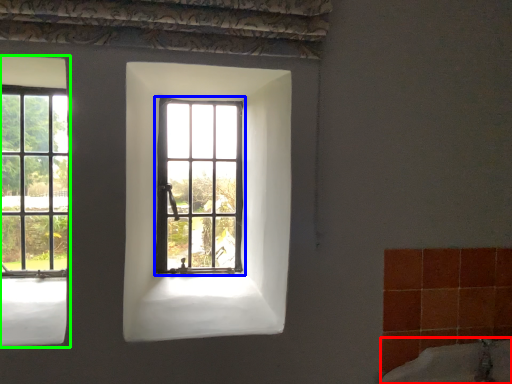
Question: Which object is the closest to the bath (highlighted by a red box)? Choose among these: window (highlighted by a blue box) or window (highlighted by a green box).

Choices:
 (A) window
 (B) window

Answer: (A)